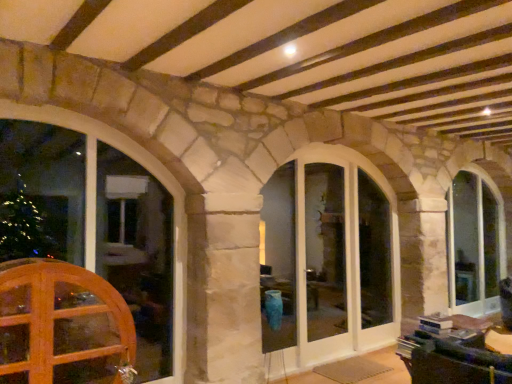
The height and width of the screenshot is (384, 512). What do you see at coordinates (152, 174) in the screenshot?
I see `wooden window at left, which appears as the first window when viewed from the left` at bounding box center [152, 174].

Image resolution: width=512 pixels, height=384 pixels. What do you see at coordinates (474, 243) in the screenshot?
I see `clear glass window at right, which is counted as the third window, starting from the left` at bounding box center [474, 243].

What do you see at coordinates (328, 258) in the screenshot?
I see `clear glass door at center, arranged as the 2th window when viewed from the back` at bounding box center [328, 258].

Find the location of `white glass door at center`. white glass door at center is located at coordinates (323, 261).

This screenshot has height=384, width=512. Identify the location of wooden glass door at lower left. (63, 317).

The image size is (512, 384). I want to click on wooden window at left, acting as the 3th window starting from the back, so click(x=152, y=174).

Would you say wooden window at left, acting as the 3th window starting from the right, is inside or outside clear glass door at center, which is the 2th window from left to right?

wooden window at left, acting as the 3th window starting from the right, lies outside clear glass door at center, which is the 2th window from left to right.

I want to click on the 1st window to the right when counting from the wooden window at left, acting as the 3th window starting from the right, so click(x=328, y=258).

Is wooden window at left, acting as the 3th window starting from the right, looking in the opposite direction of clear glass door at center, which is the 2th window from left to right?

wooden window at left, acting as the 3th window starting from the right, does not have its back to clear glass door at center, which is the 2th window from left to right.

Who is taller, wooden window at left, the 1th window from the front, or clear glass door at center, the second window positioned from the right?

With more height is wooden window at left, the 1th window from the front.

From a real-world perspective, which is physically below, wooden window at left, acting as the 3th window starting from the right, or white glass door at center?

wooden window at left, acting as the 3th window starting from the right.

From the image's perspective, between wooden window at left, which appears as the first window when viewed from the left, and white glass door at center, who is located below?

white glass door at center.

Based on the photo, is wooden window at left, which appears as the first window when viewed from the left, inside the boundaries of white glass door at center, or outside?

wooden window at left, which appears as the first window when viewed from the left, is not enclosed by white glass door at center.

Between wooden window at left, the 1th window from the front, and white glass door at center, which one has larger size?

wooden window at left, the 1th window from the front, is bigger.

Between clear glass window at right, which is counted as the third window, starting from the left, and clear glass door at center, the second window positioned from the right, which one appears on the left side from the viewer's perspective?

From the viewer's perspective, clear glass door at center, the second window positioned from the right, appears more on the left side.

What's the angular difference between clear glass window at right, the first window viewed from the back, and clear glass door at center, the second window positioned from the front,'s facing directions?

There is a 0.00409-degree angle between the facing directions of clear glass window at right, the first window viewed from the back, and clear glass door at center, the second window positioned from the front.

Which of these two, clear glass window at right, which is counted as the third window, starting from the left, or clear glass door at center, arranged as the 2th window when viewed from the back, is wider?

clear glass window at right, which is counted as the third window, starting from the left.

Is the surface of clear glass window at right, which is counted as the third window, starting from the front, in direct contact with clear glass door at center, the second window positioned from the right?

clear glass window at right, which is counted as the third window, starting from the front, is not next to clear glass door at center, the second window positioned from the right, and they're not touching.

From a real-world perspective, is wooden glass door at lower left positioned under white glass door at center based on gravity?

Yes, from a real-world perspective, wooden glass door at lower left is beneath white glass door at center.

Identify the location of door directly beneath the white glass door at center (from a real-world perspective). This screenshot has height=384, width=512. (63, 317).

Is wooden glass door at lower left far away from white glass door at center?

Absolutely, wooden glass door at lower left is distant from white glass door at center.

What's the angular difference between wooden glass door at lower left and white glass door at center's facing directions?

wooden glass door at lower left and white glass door at center are facing 1.37 degrees away from each other.

You are a GUI agent. You are given a task and a screenshot of the screen. Output one action in this format:
    pyautogui.click(x=<x>, y=<y>)
    Task: Click on the 1st window in front when counting from the clear glass window at right, the first window viewed from the back
    This screenshot has width=512, height=384.
    Given the screenshot: What is the action you would take?
    pyautogui.click(x=328, y=258)

Which is closer to the camera, (301, 251) or (474, 217)?

The point (301, 251) is more forward.

From the image's perspective, is clear glass door at center, the second window positioned from the front, on top of clear glass window at right, the 1th window from the right?

Yes.

Is clear glass door at center, the second window positioned from the right, looking in the opposite direction of clear glass window at right, the first window viewed from the back?

clear glass door at center, the second window positioned from the right, is not turned away from clear glass window at right, the first window viewed from the back.

Considering the sizes of objects wooden glass door at lower left and clear glass window at right, which is counted as the third window, starting from the front, in the image provided, who is bigger, wooden glass door at lower left or clear glass window at right, which is counted as the third window, starting from the front,?

clear glass window at right, which is counted as the third window, starting from the front.

From the image's perspective, relative to clear glass window at right, which is counted as the third window, starting from the left, is wooden glass door at lower left above or below?

wooden glass door at lower left is below clear glass window at right, which is counted as the third window, starting from the left.

Locate an element on the screen. the 3rd window behind the wooden glass door at lower left is located at coordinates (474, 243).

Which is in front, point (99, 277) or point (494, 232)?

Positioned in front is point (99, 277).

Is wooden glass door at lower left oriented away from clear glass door at center, the second window positioned from the right?

wooden glass door at lower left does not have its back to clear glass door at center, the second window positioned from the right.

Between wooden glass door at lower left and clear glass door at center, arranged as the 2th window when viewed from the back, which one has more height?

clear glass door at center, arranged as the 2th window when viewed from the back.

Considering the relative positions of wooden glass door at lower left and clear glass door at center, arranged as the 2th window when viewed from the back, in the image provided, is wooden glass door at lower left to the left of clear glass door at center, arranged as the 2th window when viewed from the back, from the viewer's perspective?

Indeed, wooden glass door at lower left is positioned on the left side of clear glass door at center, arranged as the 2th window when viewed from the back.

Considering the sizes of wooden glass door at lower left and clear glass door at center, arranged as the 2th window when viewed from the back, in the image, is wooden glass door at lower left wider or thinner than clear glass door at center, arranged as the 2th window when viewed from the back,?

Considering their sizes, wooden glass door at lower left looks broader than clear glass door at center, arranged as the 2th window when viewed from the back.

From a real-world perspective, starting from the clear glass door at center, arranged as the 2th window when viewed from the back, which window is the 1st one vertically above it? Please provide its 2D coordinates.

[(152, 174)]

The image size is (512, 384). Find the location of `window on the left of white glass door at center`. window on the left of white glass door at center is located at coordinates (152, 174).

Which object lies further to the anchor point wooden window at left, acting as the 3th window starting from the right, white glass door at center or clear glass window at right, the 1th window from the right?

Among the two, clear glass window at right, the 1th window from the right, is located further to wooden window at left, acting as the 3th window starting from the right.

Looking at the image, which one is located further to white glass door at center, wooden glass door at lower left or wooden window at left, the 1th window from the front?

wooden glass door at lower left is positioned further to the anchor white glass door at center.

Based on their spatial positions, is white glass door at center or wooden glass door at lower left further from clear glass window at right, which is counted as the third window, starting from the left?

The object further to clear glass window at right, which is counted as the third window, starting from the left, is wooden glass door at lower left.

Which object lies nearer to the anchor point clear glass door at center, the second window positioned from the right, white glass door at center or clear glass window at right, the first window viewed from the back?

white glass door at center.

From the image, which object appears to be nearer to wooden window at left, acting as the 3th window starting from the back, clear glass door at center, arranged as the 2th window when viewed from the back, or clear glass window at right, which is counted as the third window, starting from the front?

The object closer to wooden window at left, acting as the 3th window starting from the back, is clear glass door at center, arranged as the 2th window when viewed from the back.

In the scene shown: Which object lies further to the anchor point clear glass door at center, the second window positioned from the right, wooden glass door at lower left or clear glass window at right, the first window viewed from the back?

wooden glass door at lower left.

Considering their positions, is white glass door at center positioned closer to wooden glass door at lower left than clear glass window at right, the 1th window from the right?

white glass door at center is closer to wooden glass door at lower left.

When comparing their distances from wooden glass door at lower left, does clear glass door at center, the second window positioned from the front, or clear glass window at right, which is counted as the third window, starting from the left, seem further?

Among the two, clear glass window at right, which is counted as the third window, starting from the left, is located further to wooden glass door at lower left.

The width and height of the screenshot is (512, 384). What are the coordinates of `window between white glass door at center and clear glass window at right, which is counted as the third window, starting from the left` in the screenshot? It's located at (328, 258).

Where is `window between wooden glass door at lower left and clear glass window at right, which is counted as the third window, starting from the front, from left to right`? The height and width of the screenshot is (384, 512). window between wooden glass door at lower left and clear glass window at right, which is counted as the third window, starting from the front, from left to right is located at coordinates (328, 258).

This screenshot has height=384, width=512. What are the coordinates of `door located between wooden window at left, acting as the 3th window starting from the right, and clear glass door at center, arranged as the 2th window when viewed from the back, in the left-right direction` in the screenshot? It's located at (63, 317).

This screenshot has width=512, height=384. I want to click on screen door situated between wooden window at left, which appears as the first window when viewed from the left, and clear glass window at right, which is counted as the third window, starting from the front, from left to right, so click(x=323, y=261).